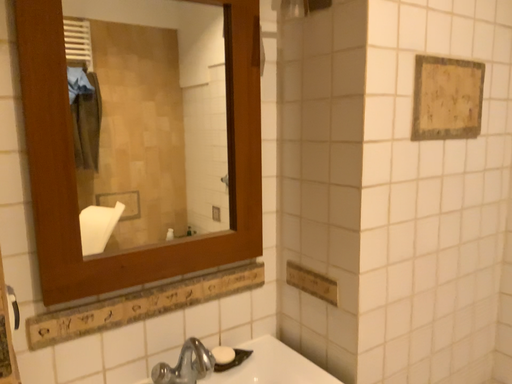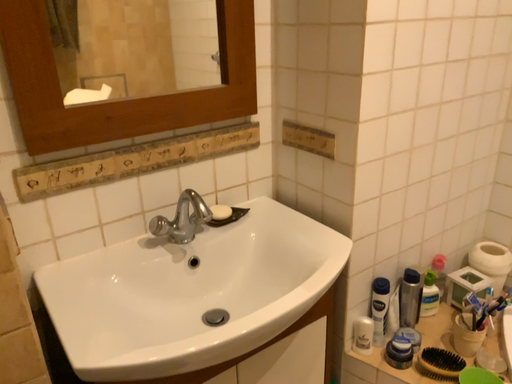
Question: Which way did the camera rotate in the video?

Choices:
 (A) rotated downward
 (B) rotated upward

Answer: (A)